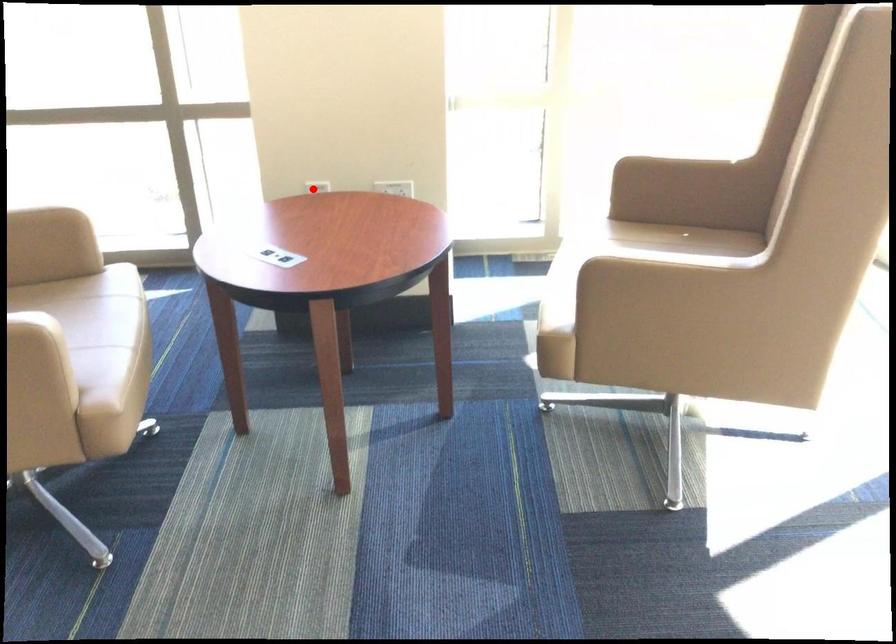
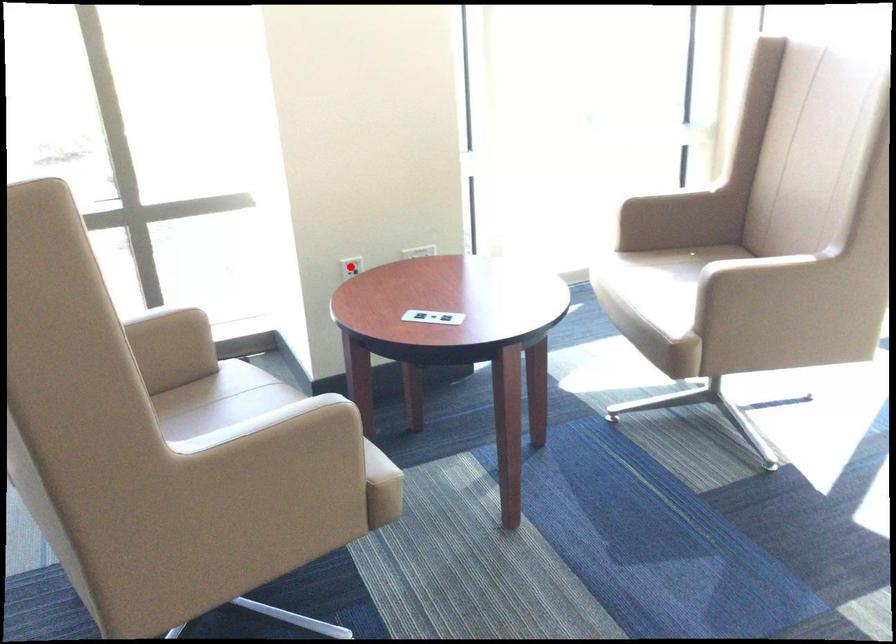
I am providing you with two images of the same scene from different viewpoints. A red point is marked on the first image and another point is marked on the second image. Does the point marked in image1 correspond to the same location as the one in image2?

Yes